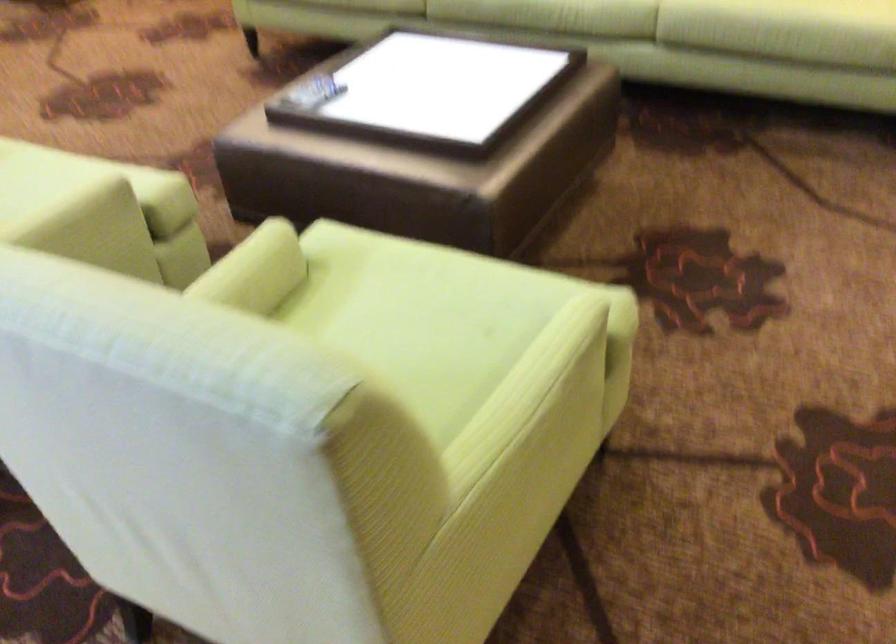
Where is `chair sitting surface`? chair sitting surface is located at coordinates (410, 328).